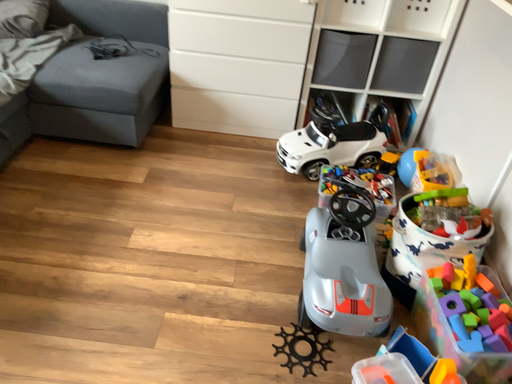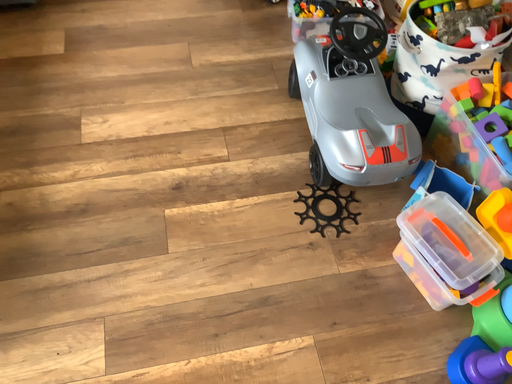
Question: Which way did the camera rotate in the video?

Choices:
 (A) rotated downward
 (B) rotated upward

Answer: (A)